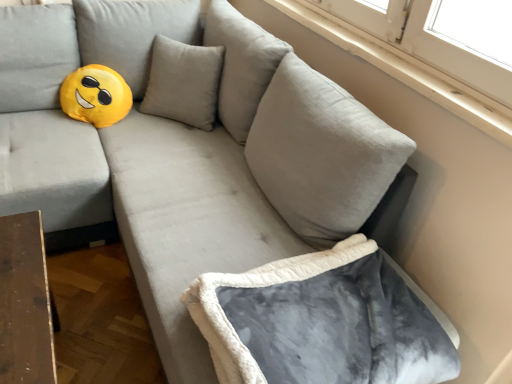
Describe the element at coordinates (399, 69) in the screenshot. I see `white smooth window sill at upper right` at that location.

Locate an element on the screen. The height and width of the screenshot is (384, 512). white smooth window sill at upper right is located at coordinates 399,69.

What is the approximate width of white smooth window sill at upper right?

The width of white smooth window sill at upper right is 4.24 inches.

Measure the distance between white smooth window sill at upper right and camera.

The distance of white smooth window sill at upper right from camera is 3.74 feet.

Describe the element at coordinates (321, 322) in the screenshot. The width and height of the screenshot is (512, 384). I see `gray fleece bean bag chair at lower right` at that location.

In order to click on gray fleece bean bag chair at lower right in this screenshot , I will do `click(321, 322)`.

Find the location of `white smooth window sill at upper right`. white smooth window sill at upper right is located at coordinates (399, 69).

Does white smooth window sill at upper right appear on the left side of gray fleece bean bag chair at lower right?

In fact, white smooth window sill at upper right is to the right of gray fleece bean bag chair at lower right.

Which object is closer to the camera taking this photo, white smooth window sill at upper right or gray fleece bean bag chair at lower right?

gray fleece bean bag chair at lower right.

Which point is more forward, (274, 5) or (345, 323)?

The point (345, 323) is closer.

From the image's perspective, is white smooth window sill at upper right over gray fleece bean bag chair at lower right?

Indeed, from the image's perspective, white smooth window sill at upper right is shown above gray fleece bean bag chair at lower right.

From a real-world perspective, is white smooth window sill at upper right located higher than gray fleece bean bag chair at lower right?

Yes, from a real-world perspective, white smooth window sill at upper right is on top of gray fleece bean bag chair at lower right.

Looking at their sizes, would you say white smooth window sill at upper right is wider or thinner than gray fleece bean bag chair at lower right?

white smooth window sill at upper right is thinner than gray fleece bean bag chair at lower right.

Who is taller, white smooth window sill at upper right or gray fleece bean bag chair at lower right?

Standing taller between the two is gray fleece bean bag chair at lower right.

Looking at the image, does white smooth window sill at upper right seem bigger or smaller compared to gray fleece bean bag chair at lower right?

Clearly, white smooth window sill at upper right is smaller in size than gray fleece bean bag chair at lower right.

In the scene shown: Choose the correct answer: Is white smooth window sill at upper right inside gray fleece bean bag chair at lower right or outside it?

white smooth window sill at upper right is not enclosed by gray fleece bean bag chair at lower right.

Is white smooth window sill at upper right not near gray fleece bean bag chair at lower right?

No, white smooth window sill at upper right is in close proximity to gray fleece bean bag chair at lower right.

Could you tell me if white smooth window sill at upper right is facing gray fleece bean bag chair at lower right?

No, white smooth window sill at upper right is not aimed at gray fleece bean bag chair at lower right.

Can you tell me how much white smooth window sill at upper right and gray fleece bean bag chair at lower right differ in facing direction?

89.9 degrees.

You are a GUI agent. You are given a task and a screenshot of the screen. Output one action in this format:
    pyautogui.click(x=<x>, y=<y>)
    Task: Click on the window sill above the gray fleece bean bag chair at lower right (from a real-world perspective)
    
    Given the screenshot: What is the action you would take?
    [x=399, y=69]

Which object is positioned more to the right, gray fleece bean bag chair at lower right or white smooth window sill at upper right?

From the viewer's perspective, white smooth window sill at upper right appears more on the right side.

Does gray fleece bean bag chair at lower right come in front of white smooth window sill at upper right?

Yes, the depth of gray fleece bean bag chair at lower right is less than that of white smooth window sill at upper right.

Between point (378, 363) and point (463, 116), which one is positioned behind?

Positioned behind is point (463, 116).

From the image's perspective, is gray fleece bean bag chair at lower right over white smooth window sill at upper right?

No, from the image's perspective, gray fleece bean bag chair at lower right is not above white smooth window sill at upper right.

From a real-world perspective, relative to white smooth window sill at upper right, is gray fleece bean bag chair at lower right vertically above or below?

Clearly, from a real-world perspective, gray fleece bean bag chair at lower right is below white smooth window sill at upper right.

From the picture: Is gray fleece bean bag chair at lower right wider than white smooth window sill at upper right?

Indeed, gray fleece bean bag chair at lower right has a greater width compared to white smooth window sill at upper right.

Considering the relative sizes of gray fleece bean bag chair at lower right and white smooth window sill at upper right in the image provided, is gray fleece bean bag chair at lower right shorter than white smooth window sill at upper right?

In fact, gray fleece bean bag chair at lower right may be taller than white smooth window sill at upper right.

Which of these two, gray fleece bean bag chair at lower right or white smooth window sill at upper right, is smaller?

white smooth window sill at upper right.

Is gray fleece bean bag chair at lower right not within white smooth window sill at upper right?

Yes, gray fleece bean bag chair at lower right is located beyond the bounds of white smooth window sill at upper right.

Is gray fleece bean bag chair at lower right with white smooth window sill at upper right?

No.

Could you tell me if gray fleece bean bag chair at lower right is facing white smooth window sill at upper right?

No, gray fleece bean bag chair at lower right is not turned towards white smooth window sill at upper right.

The image size is (512, 384). In order to click on window sill that is on the right side of gray fleece bean bag chair at lower right in this screenshot , I will do `click(399, 69)`.

You are a GUI agent. You are given a task and a screenshot of the screen. Output one action in this format:
    pyautogui.click(x=<x>, y=<y>)
    Task: Click on the window sill above the gray fleece bean bag chair at lower right (from the image's perspective)
    
    Given the screenshot: What is the action you would take?
    pyautogui.click(x=399, y=69)

Image resolution: width=512 pixels, height=384 pixels. I want to click on bean bag chair below the white smooth window sill at upper right (from a real-world perspective), so click(321, 322).